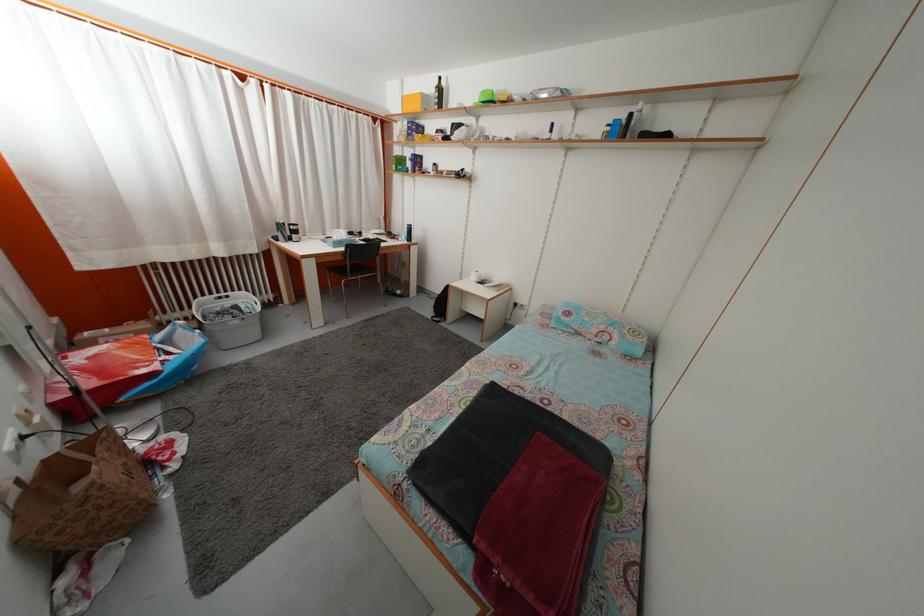
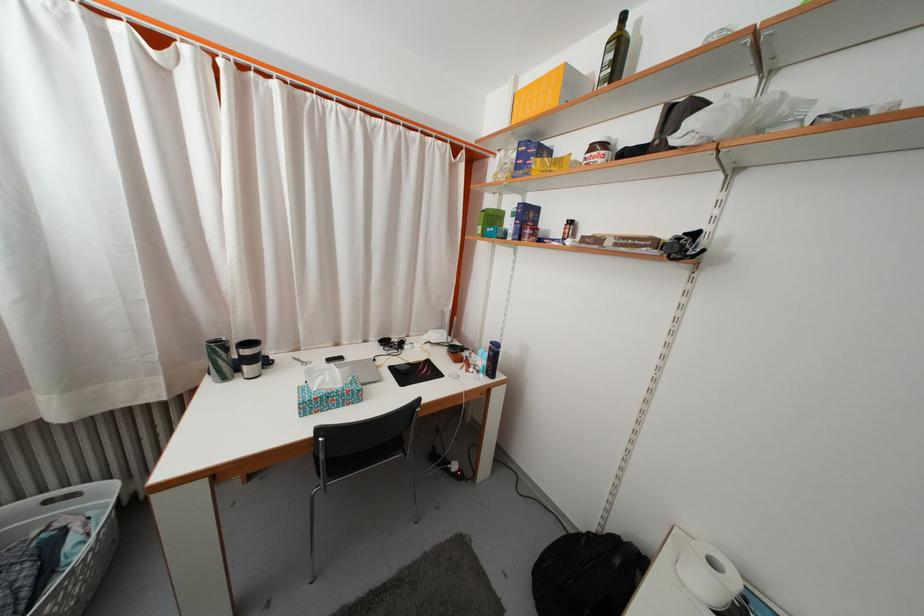
In the second image, find the point that corresponds to (x=445, y=98) in the first image.

(625, 54)